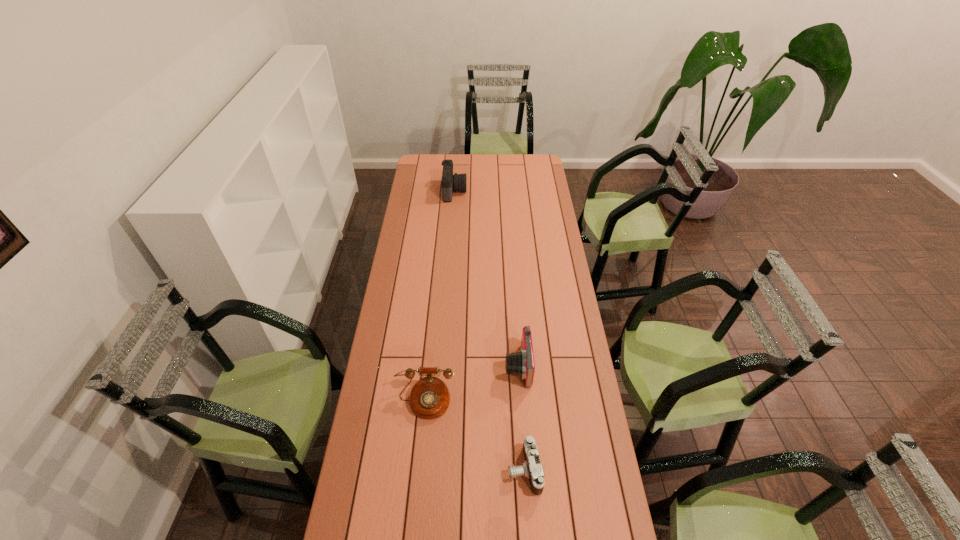
Where is `vacant space situated on the front-facing side of the second nearest camera`? The image size is (960, 540). vacant space situated on the front-facing side of the second nearest camera is located at coordinates (436, 366).

Image resolution: width=960 pixels, height=540 pixels. What are the coordinates of `free location located 0.130m at the lens of the shortest object` in the screenshot? It's located at (467, 470).

Locate an element on the screen. The height and width of the screenshot is (540, 960). vacant point located 0.250m at the lens of the shortest object is located at coordinates (429, 470).

This screenshot has width=960, height=540. Identify the location of vacant region located at the lens of the shortest object. [x=486, y=470].

The width and height of the screenshot is (960, 540). What are the coordinates of `object that is positioned at the left edge` in the screenshot? It's located at (429, 398).

This screenshot has width=960, height=540. I want to click on vacant point at the far edge, so click(x=477, y=158).

You are a GUI agent. You are given a task and a screenshot of the screen. Output one action in this format:
    pyautogui.click(x=<x>, y=<y>)
    Task: Click on the vacant space at the left edge of the desktop
    
    Given the screenshot: What is the action you would take?
    pyautogui.click(x=402, y=328)

Locate an element on the screen. This screenshot has height=540, width=960. vacant space at the right edge of the desktop is located at coordinates (577, 333).

You are a GUI agent. You are given a task and a screenshot of the screen. Output one action in this format:
    pyautogui.click(x=<x>, y=<y>)
    Task: Click on the blank space at the far right corner of the desktop
    This screenshot has height=540, width=960.
    Given the screenshot: What is the action you would take?
    pyautogui.click(x=534, y=165)

Identify the location of free space between the shortest camera and the second nearest camera. (520, 418).